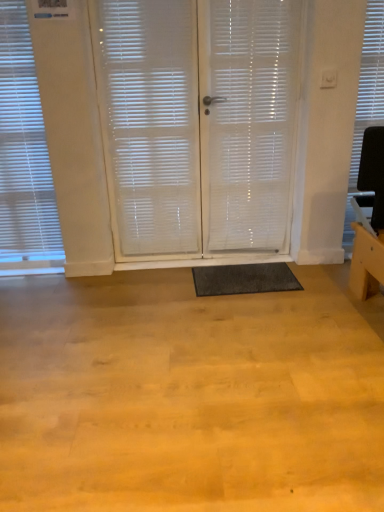
Question: Is white translucent curtain at center inside or outside of white textured blind at upper right, acting as the second window blind starting from the left?

Choices:
 (A) outside
 (B) inside

Answer: (A)

Question: From a real-world perspective, relative to white textured blind at upper right, positioned as the 1th window blind in right-to-left order, is white translucent curtain at center vertically above or below?

Choices:
 (A) below
 (B) above

Answer: (A)

Question: Which object is the farthest from the white textured blind at upper right, acting as the second window blind starting from the left?

Choices:
 (A) white translucent curtain at center
 (B) white translucent blinds at left, which is counted as the first window blind, starting from the left
 (C) white textured screen door at center, marked as the first screen door in a left-to-right arrangement
 (D) white translucent screen door at center, which is the 2th screen door in left-to-right order
 (E) dark gray rubber mat at center

Answer: (B)

Question: Estimate the real-world distances between objects in this image. Which object is farther from the white translucent blinds at left, the second window blind when ordered from right to left?

Choices:
 (A) white textured screen door at center, which is the second screen door in right-to-left order
 (B) dark gray rubber mat at center
 (C) white translucent screen door at center, the 1th screen door viewed from the right
 (D) white translucent curtain at center
 (E) white textured blind at upper right, acting as the second window blind starting from the left

Answer: (E)